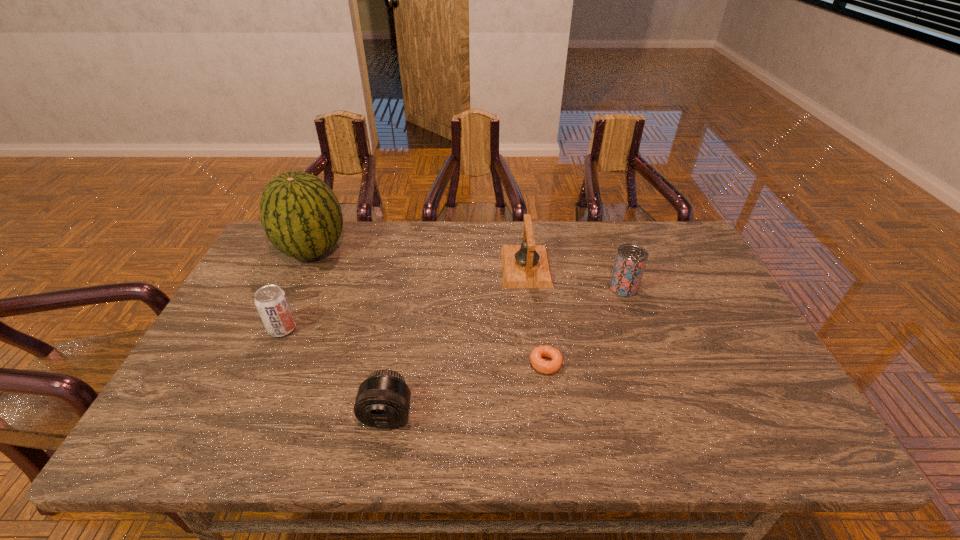
Find the location of a particular element. free point between the telephoto lens and the shortest object is located at coordinates (467, 389).

Locate an element on the screen. The height and width of the screenshot is (540, 960). free spot between the fourth farthest object and the rightmost object is located at coordinates (453, 308).

Locate an element on the screen. The width and height of the screenshot is (960, 540). vacant region between the bell and the soda can is located at coordinates (404, 298).

Identify the location of the closest object to the doughnut. (527, 265).

The image size is (960, 540). What are the coordinates of `the second closest object to the bell` in the screenshot? It's located at (541, 365).